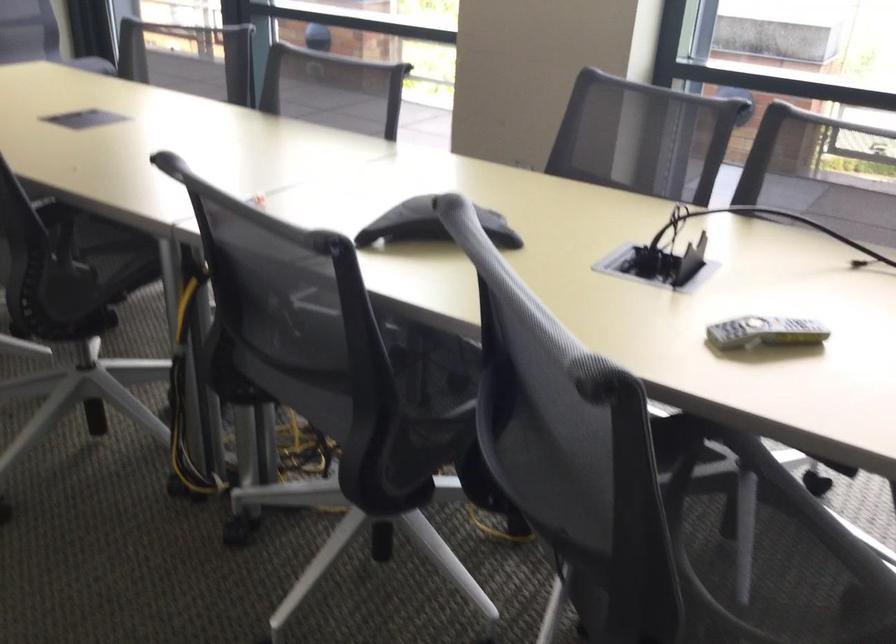
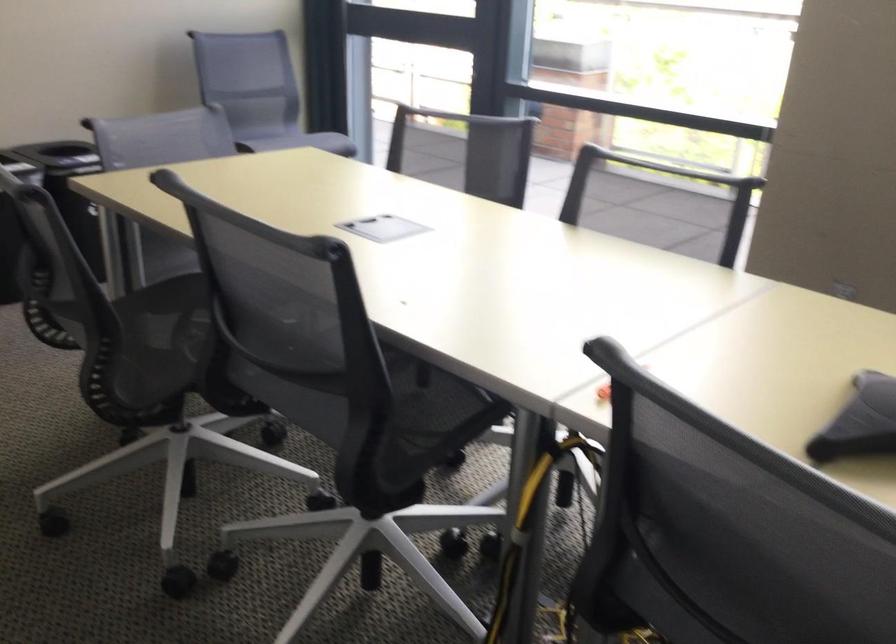
Question: The camera is either moving clockwise (left) or counter-clockwise (right) around the object. The first image is from the beginning of the video and the second image is from the end. Is the camera moving left or right when shooting the video?

Choices:
 (A) Left
 (B) Right

Answer: (B)